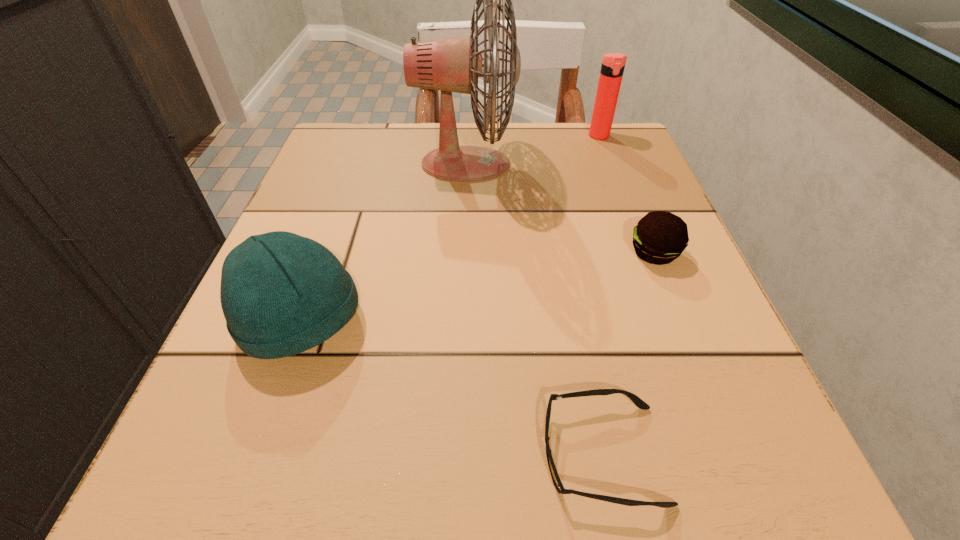
Where is `the tallest object`? the tallest object is located at coordinates (454, 64).

You are a GUI agent. You are given a task and a screenshot of the screen. Output one action in this format:
    pyautogui.click(x=<x>, y=<y>)
    Task: Click on the thermos bottle
    The width and height of the screenshot is (960, 540).
    Given the screenshot: What is the action you would take?
    pyautogui.click(x=613, y=64)

Find the location of `the third shortest object`. the third shortest object is located at coordinates (281, 294).

Identify the location of the leftmost object. (281, 294).

Where is `patty`? The width and height of the screenshot is (960, 540). patty is located at coordinates (660, 237).

In order to click on the third nearest object in this screenshot , I will do `click(660, 237)`.

You are a GUI agent. You are given a task and a screenshot of the screen. Output one action in this format:
    pyautogui.click(x=<x>, y=<y>)
    Task: Click on the nearest object
    The image size is (960, 540).
    Given the screenshot: What is the action you would take?
    pyautogui.click(x=635, y=399)

The width and height of the screenshot is (960, 540). I want to click on spectacles, so click(x=635, y=399).

Find the location of a particular element. The width and height of the screenshot is (960, 540). vacant point located in front of the fan to direct airflow is located at coordinates (613, 165).

The width and height of the screenshot is (960, 540). Identify the location of vacant area situated on the front of the second tallest object. (646, 261).